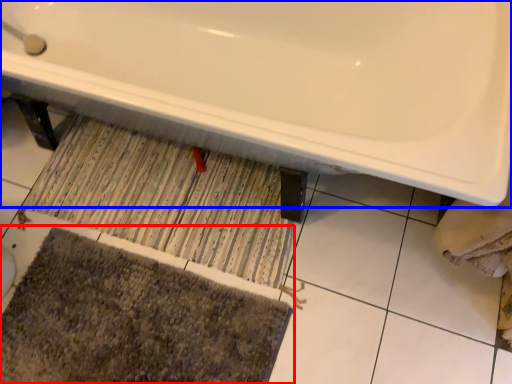
Question: Which point is closer to the camera, bath mat (highlighted by a red box) or bathtub (highlighted by a blue box)?

Choices:
 (A) bath mat
 (B) bathtub

Answer: (B)